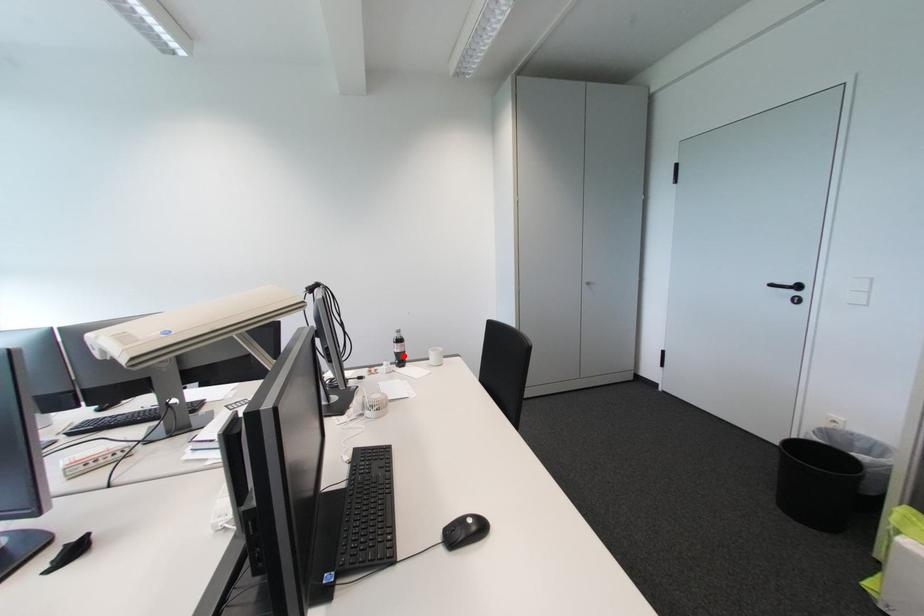
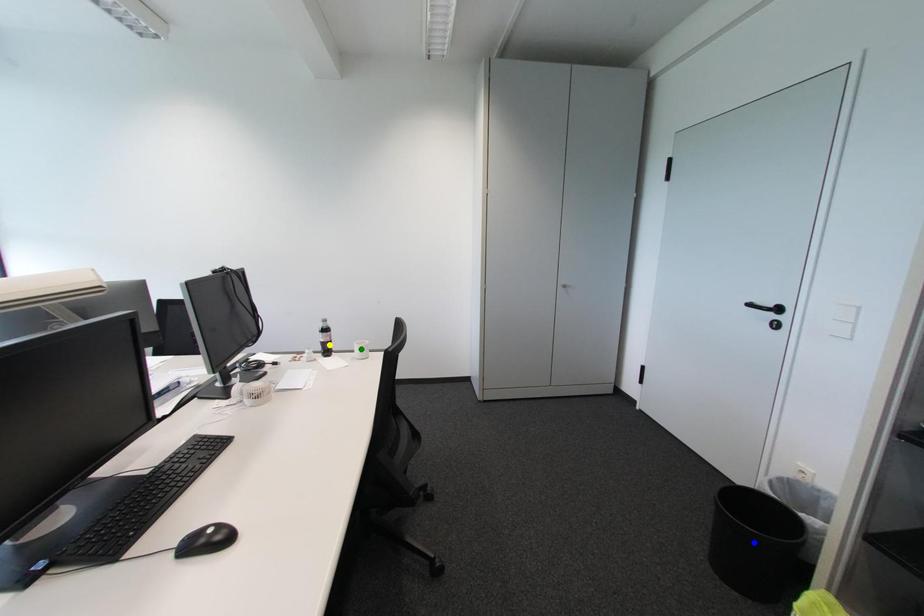
Question: I am providing you with two images of the same scene from different viewpoints. A red point is marked on the first image. You are given multiple points on the second image. Can you choose the point in image 2 that corresponds to the point in image 1?

Choices:
 (A) blue point
 (B) green point
 (C) yellow point

Answer: (C)